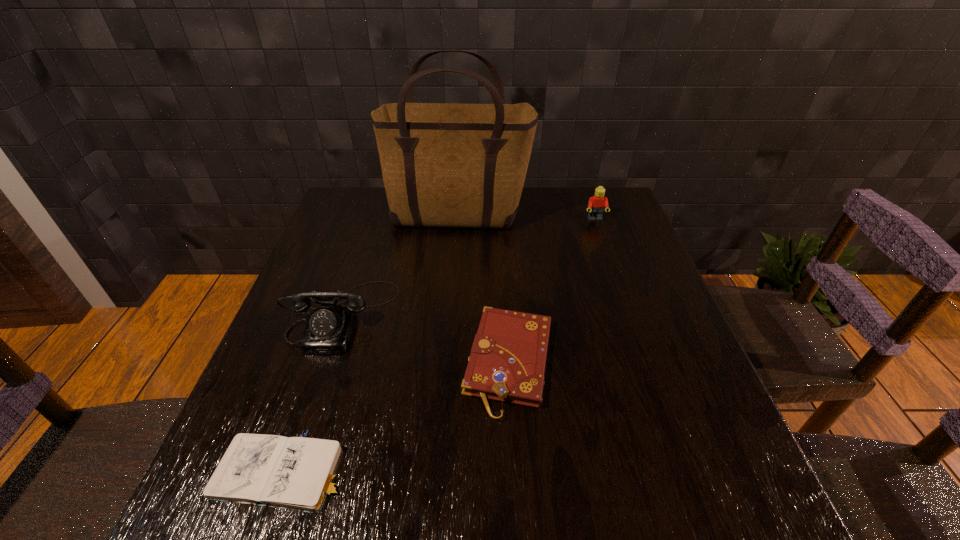
I want to click on free space between the rightmost object and the telephone, so click(x=468, y=267).

Find the location of `blank region between the Lego and the shortest object`. blank region between the Lego and the shortest object is located at coordinates (439, 346).

In order to click on free space between the farther notebook and the telephone in this screenshot , I will do `click(424, 339)`.

At what (x,y) coordinates should I click in order to perform the action: click on vacant area between the tote bag and the Lego. Please return your answer as a coordinate pair (x, y). Looking at the image, I should click on (527, 219).

This screenshot has height=540, width=960. Identify the location of vacant area between the tote bag and the telephone. (399, 267).

Identify which object is the nearest to the tote bag. Please provide its 2D coordinates. Your answer should be formatted as a tuple, i.e. [(x, y)], where the tuple contains the x and y coordinates of a point satisfying the conditions above.

[(596, 204)]

Find the location of `the third closest object to the nearer notebook`. the third closest object to the nearer notebook is located at coordinates (456, 165).

At what (x,y) coordinates should I click in order to perform the action: click on free space that satisfies the following two spatial constraints: 1. on the back side of the tallest object; 2. on the right side of the shortest object. Please return your answer as a coordinate pair (x, y). The height and width of the screenshot is (540, 960). Looking at the image, I should click on (369, 219).